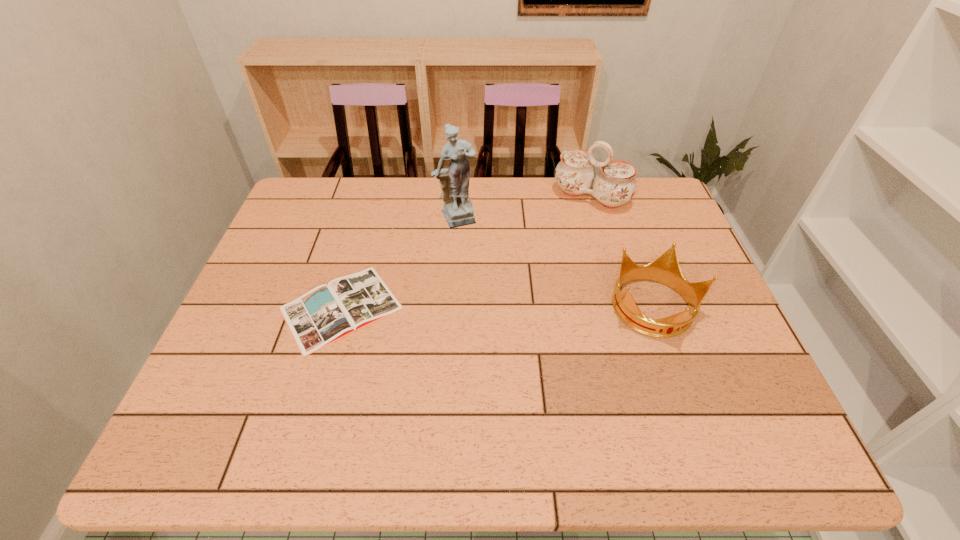
Locate an element on the screen. vacant position located 0.340m by the handle of the second tallest object is located at coordinates (530, 282).

Locate an element on the screen. This screenshot has height=540, width=960. free space located 0.060m on the front-facing side of the figurine is located at coordinates (473, 242).

This screenshot has height=540, width=960. Identify the location of free location located 0.290m on the front-facing side of the figurine. (508, 297).

You are a GUI agent. You are given a task and a screenshot of the screen. Output one action in this format:
    pyautogui.click(x=<x>, y=<y>)
    Task: Click on the free region located on the front-facing side of the figurine
    The width and height of the screenshot is (960, 540).
    Given the screenshot: What is the action you would take?
    pyautogui.click(x=508, y=297)

Find the location of `chinaware present at the far edge`. chinaware present at the far edge is located at coordinates (615, 184).

You are a GUI agent. You are given a task and a screenshot of the screen. Output one action in this format:
    pyautogui.click(x=<x>, y=<y>)
    Task: Click on the figurine situated at the far edge
    
    Given the screenshot: What is the action you would take?
    pyautogui.click(x=454, y=181)

The image size is (960, 540). In order to click on object located in the left edge section of the desktop in this screenshot , I will do `click(327, 313)`.

Locate an element on the screen. Image resolution: width=960 pixels, height=540 pixels. crown positioned at the right edge is located at coordinates (665, 269).

This screenshot has height=540, width=960. Identify the location of chinaware that is positioned at the right edge. (615, 184).

Locate an element on the screen. object at the far right corner is located at coordinates (615, 184).